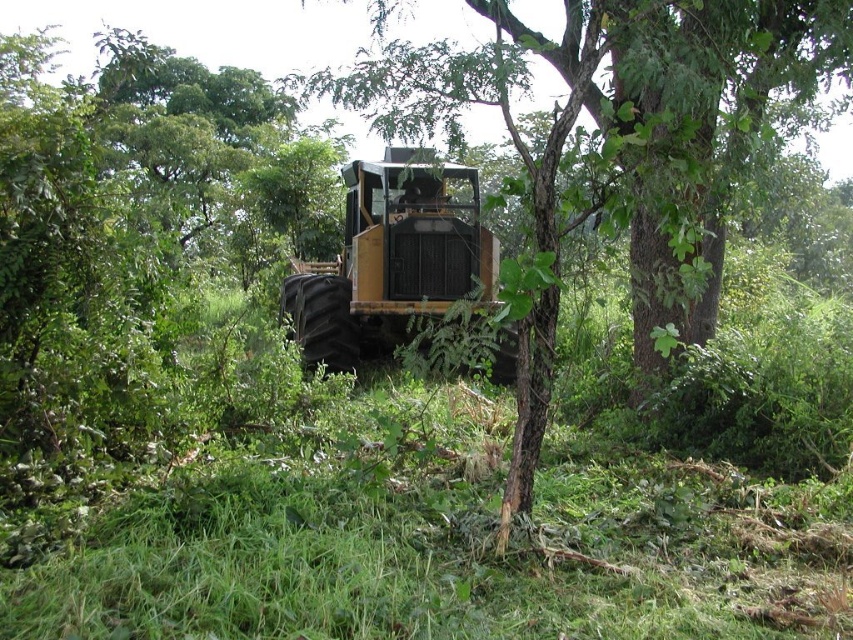
Question: Can you confirm if green leafy tree at center is positioned below yellow metallic tractor at center?

Choices:
 (A) no
 (B) yes

Answer: (A)

Question: Considering the relative positions of green leafy tree at center and yellow metallic tractor at center in the image provided, where is green leafy tree at center located with respect to yellow metallic tractor at center?

Choices:
 (A) below
 (B) above

Answer: (B)

Question: Does green leafy tree at center appear on the left side of yellow metallic tractor at center?

Choices:
 (A) no
 (B) yes

Answer: (A)

Question: Among these objects, which one is farthest from the camera?

Choices:
 (A) green leafy tree at center
 (B) yellow metallic tractor at center

Answer: (B)

Question: Which object appears farthest from the camera in this image?

Choices:
 (A) yellow metallic tractor at center
 (B) green leafy tree at center

Answer: (A)